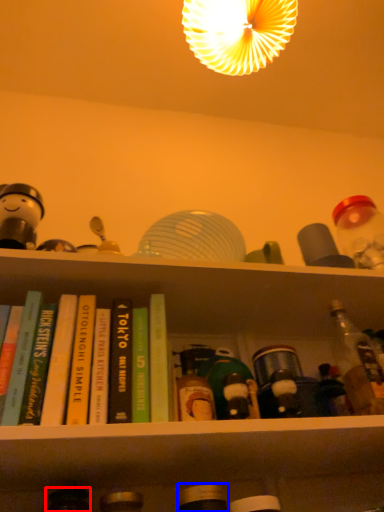
Question: Which of the following is the farthest to the observer, bottle (highlighted by a red box) or bottle (highlighted by a blue box)?

Choices:
 (A) bottle
 (B) bottle

Answer: (A)